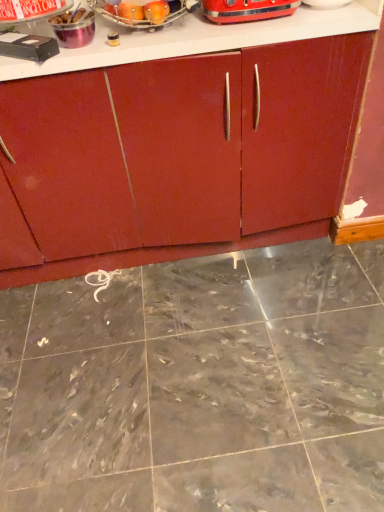
Measure the distance between point (0,99) and camera.

Point (0,99) is 1.26 meters from camera.

Identify the location of matte wood cabinet at center. (210, 148).

What are the coordinates of `black plastic vcr at upper left, the 1th appliance viewed from the left` in the screenshot? It's located at (28, 46).

Image resolution: width=384 pixels, height=512 pixels. I want to click on gray marble floor at center, so click(x=198, y=385).

Measure the distance from metallic silver fruit basket at upper center, placed as the fourth appliance when sorted from left to right, to shiny metallic toaster at upper center, the fifth appliance when ordered from left to right.

metallic silver fruit basket at upper center, placed as the fourth appliance when sorted from left to right, and shiny metallic toaster at upper center, the fifth appliance when ordered from left to right, are 7.35 inches apart.

Do you think metallic silver fruit basket at upper center, the second appliance from the right, is within shiny metallic toaster at upper center, the fifth appliance when ordered from left to right, or outside of it?

metallic silver fruit basket at upper center, the second appliance from the right, is not inside shiny metallic toaster at upper center, the fifth appliance when ordered from left to right, it's outside.

Can you confirm if metallic silver fruit basket at upper center, the second appliance from the right, is positioned to the right of shiny metallic toaster at upper center, the fifth appliance when ordered from left to right?

In fact, metallic silver fruit basket at upper center, the second appliance from the right, is to the left of shiny metallic toaster at upper center, the fifth appliance when ordered from left to right.

Who is smaller, metallic silver fruit basket at upper center, placed as the fourth appliance when sorted from left to right, or shiny metallic toaster at upper center, arranged as the first appliance when viewed from the right?

shiny metallic toaster at upper center, arranged as the first appliance when viewed from the right.

From the picture: Is the depth of metallic silver fruit basket at upper center, the second appliance from the right, greater than that of gray marble floor at center?

Yes, it is.

Would you say metallic silver fruit basket at upper center, placed as the fourth appliance when sorted from left to right, is inside or outside gray marble floor at center?

metallic silver fruit basket at upper center, placed as the fourth appliance when sorted from left to right, is spatially situated outside gray marble floor at center.

From the picture: Is metallic silver fruit basket at upper center, the second appliance from the right, aimed at gray marble floor at center?

No, metallic silver fruit basket at upper center, the second appliance from the right, is not turned towards gray marble floor at center.

Measure the distance from metallic silver fruit basket at upper center, placed as the fourth appliance when sorted from left to right, to gray marble floor at center.

1.15 meters.

What's the angular difference between metallic silver toaster at upper center, arranged as the second appliance when viewed from the left, and matte wood cabinet at center's facing directions?

1.59 degrees.

From a real-world perspective, does metallic silver toaster at upper center, arranged as the second appliance when viewed from the left, sit lower than matte wood cabinet at center?

No, from a real-world perspective, metallic silver toaster at upper center, arranged as the second appliance when viewed from the left, is not under matte wood cabinet at center.

Is metallic silver toaster at upper center, which is counted as the fourth appliance, starting from the right, wider than matte wood cabinet at center?

No.

From the image's perspective, is black plastic vcr at upper left, the 1th appliance viewed from the left, positioned above or below matte wood cabinet at center?

From the image's perspective, black plastic vcr at upper left, the 1th appliance viewed from the left, appears above matte wood cabinet at center.

Would you say black plastic vcr at upper left, the 1th appliance viewed from the left, is outside matte wood cabinet at center?

Yes, black plastic vcr at upper left, the 1th appliance viewed from the left, is outside of matte wood cabinet at center.

Does black plastic vcr at upper left, which ranks as the 5th appliance in right-to-left order, appear on the right side of matte wood cabinet at center?

No.

From their relative heights in the image, would you say black plastic vcr at upper left, the 1th appliance viewed from the left, is taller or shorter than metallic silver fruit basket at upper center, the second appliance from the right?

Clearly, black plastic vcr at upper left, the 1th appliance viewed from the left, is shorter compared to metallic silver fruit basket at upper center, the second appliance from the right.

From the image's perspective, would you say black plastic vcr at upper left, the 1th appliance viewed from the left, is shown under metallic silver fruit basket at upper center, placed as the fourth appliance when sorted from left to right?

Yes, from the image's perspective, black plastic vcr at upper left, the 1th appliance viewed from the left, is below metallic silver fruit basket at upper center, placed as the fourth appliance when sorted from left to right.

Can you confirm if black plastic vcr at upper left, the 1th appliance viewed from the left, is smaller than metallic silver fruit basket at upper center, the second appliance from the right?

Correct, black plastic vcr at upper left, the 1th appliance viewed from the left, occupies less space than metallic silver fruit basket at upper center, the second appliance from the right.

Measure the distance from black plastic vcr at upper left, the 1th appliance viewed from the left, to metallic silver fruit basket at upper center, placed as the fourth appliance when sorted from left to right.

black plastic vcr at upper left, the 1th appliance viewed from the left, is 11.31 inches away from metallic silver fruit basket at upper center, placed as the fourth appliance when sorted from left to right.

Is gray marble floor at center touching matte wood cabinet at center?

gray marble floor at center and matte wood cabinet at center are not in contact.

How far apart are gray marble floor at center and matte wood cabinet at center?

gray marble floor at center is 21.40 inches from matte wood cabinet at center.

Is gray marble floor at center facing away from matte wood cabinet at center?

No, matte wood cabinet at center is not at the back of gray marble floor at center.

Relative to matte wood cabinet at center, is gray marble floor at center in front or behind?

gray marble floor at center is positioned closer to the viewer than matte wood cabinet at center.

Considering the relative sizes of metallic silver container at upper left, which ranks as the third appliance in right-to-left order, and shiny metallic toaster at upper center, the fifth appliance when ordered from left to right, in the image provided, is metallic silver container at upper left, which ranks as the third appliance in right-to-left order, bigger than shiny metallic toaster at upper center, the fifth appliance when ordered from left to right,?

No.

This screenshot has width=384, height=512. What are the coordinates of `the 2nd appliance to the left of the shiny metallic toaster at upper center, arranged as the first appliance when viewed from the right, counting from the anchor's position` in the screenshot? It's located at (74, 28).

Is shiny metallic toaster at upper center, the fifth appliance when ordered from left to right, inside metallic silver container at upper left, the third appliance positioned from the left?

No, shiny metallic toaster at upper center, the fifth appliance when ordered from left to right, is not inside metallic silver container at upper left, the third appliance positioned from the left.

Which is closer, [86,22] or [263,11]?

The point [263,11] is more forward.

Which appliance is the 2nd one when counting from the back of the metallic silver fruit basket at upper center, the second appliance from the right? Please provide its 2D coordinates.

[(247, 10)]

In the image, there is a metallic silver fruit basket at upper center, the second appliance from the right. Identify the location of granite below it (from a real-world perspective). pos(198,385).

In the scene shown: Which object lies nearer to the anchor point gray marble floor at center, black plastic vcr at upper left, the 1th appliance viewed from the left, or metallic silver fruit basket at upper center, the second appliance from the right?

black plastic vcr at upper left, the 1th appliance viewed from the left, lies closer to gray marble floor at center than the other object.

From the image, which object appears to be farther from shiny metallic toaster at upper center, the fifth appliance when ordered from left to right, metallic silver toaster at upper center, arranged as the second appliance when viewed from the left, or metallic silver container at upper left, which ranks as the third appliance in right-to-left order?

metallic silver toaster at upper center, arranged as the second appliance when viewed from the left, is positioned further to the anchor shiny metallic toaster at upper center, the fifth appliance when ordered from left to right.

From the image, which object appears to be farther from matte wood cabinet at center, metallic silver toaster at upper center, arranged as the second appliance when viewed from the left, or shiny metallic toaster at upper center, arranged as the first appliance when viewed from the right?

The object further to matte wood cabinet at center is metallic silver toaster at upper center, arranged as the second appliance when viewed from the left.

Which object lies further to the anchor point black plastic vcr at upper left, which ranks as the 5th appliance in right-to-left order, shiny metallic toaster at upper center, the fifth appliance when ordered from left to right, or metallic silver fruit basket at upper center, placed as the fourth appliance when sorted from left to right?

shiny metallic toaster at upper center, the fifth appliance when ordered from left to right.

From the image, which object appears to be farther from metallic silver toaster at upper center, which is counted as the fourth appliance, starting from the right, matte wood cabinet at center or metallic silver container at upper left, which ranks as the third appliance in right-to-left order?

The object further to metallic silver toaster at upper center, which is counted as the fourth appliance, starting from the right, is matte wood cabinet at center.

Which object lies nearer to the anchor point metallic silver toaster at upper center, arranged as the second appliance when viewed from the left, gray marble floor at center or metallic silver fruit basket at upper center, the second appliance from the right?

metallic silver fruit basket at upper center, the second appliance from the right, lies closer to metallic silver toaster at upper center, arranged as the second appliance when viewed from the left, than the other object.

When comparing their distances from shiny metallic toaster at upper center, the fifth appliance when ordered from left to right, does metallic silver fruit basket at upper center, placed as the fourth appliance when sorted from left to right, or black plastic vcr at upper left, which ranks as the 5th appliance in right-to-left order, seem further?

black plastic vcr at upper left, which ranks as the 5th appliance in right-to-left order.

Estimate the real-world distances between objects in this image. Which object is closer to gray marble floor at center, shiny metallic toaster at upper center, the fifth appliance when ordered from left to right, or metallic silver toaster at upper center, which is counted as the fourth appliance, starting from the right?

The object closer to gray marble floor at center is shiny metallic toaster at upper center, the fifth appliance when ordered from left to right.

This screenshot has width=384, height=512. In order to click on cabinetry between black plastic vcr at upper left, the 1th appliance viewed from the left, and gray marble floor at center in the up-down direction in this screenshot , I will do `click(210, 148)`.

At what (x,y) coordinates should I click in order to perform the action: click on cabinetry situated between metallic silver toaster at upper center, arranged as the second appliance when viewed from the left, and shiny metallic toaster at upper center, the fifth appliance when ordered from left to right, from left to right. Please return your answer as a coordinate pair (x, y). Looking at the image, I should click on (210, 148).

Where is `appliance between metallic silver toaster at upper center, which is counted as the fourth appliance, starting from the right, and metallic silver fruit basket at upper center, the second appliance from the right, in the horizontal direction`? This screenshot has width=384, height=512. appliance between metallic silver toaster at upper center, which is counted as the fourth appliance, starting from the right, and metallic silver fruit basket at upper center, the second appliance from the right, in the horizontal direction is located at coordinates (74, 28).

You are a GUI agent. You are given a task and a screenshot of the screen. Output one action in this format:
    pyautogui.click(x=<x>, y=<y>)
    Task: Click on the appliance between metallic silver container at upper left, the third appliance positioned from the left, and shiny metallic toaster at upper center, the fifth appliance when ordered from left to right, from left to right
    This screenshot has width=384, height=512.
    Given the screenshot: What is the action you would take?
    pyautogui.click(x=144, y=13)